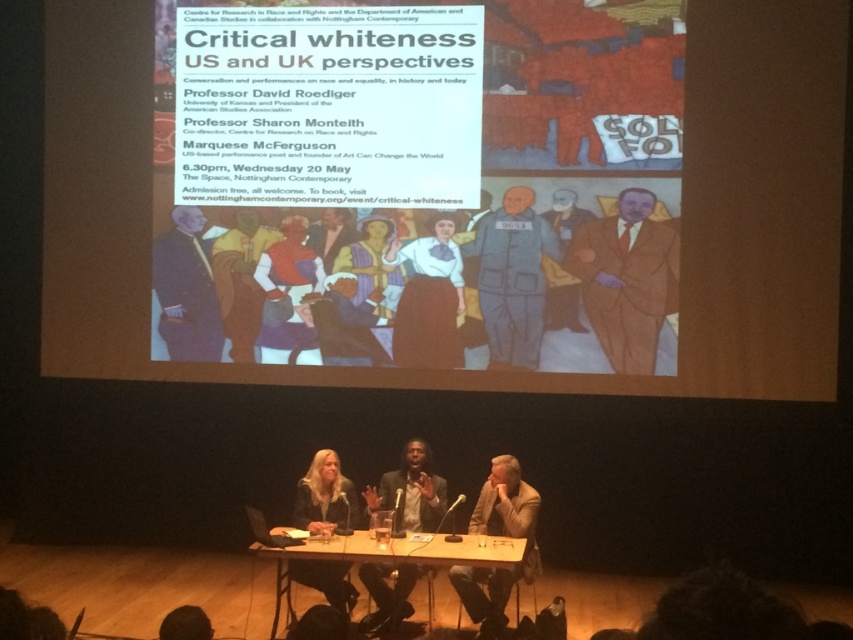
Question: Based on their relative distances, which object is farther from the brown textured suit at right?

Choices:
 (A) matte black suit at center
 (B) light brown leather jacket at lower right
 (C) wooden at center
 (D) matte paper poster at center

Answer: (A)

Question: Is dark gray suit at center below matte black jacket at center?

Choices:
 (A) yes
 (B) no

Answer: (B)

Question: Which point is closer to the camera taking this photo?

Choices:
 (A) (209, 269)
 (B) (486, 589)
 (C) (579, 260)
 (D) (332, 568)

Answer: (D)

Question: Estimate the real-world distances between objects in this image. Which object is closer to the matte black jacket at center?

Choices:
 (A) wooden at center
 (B) matte paper poster at center
 (C) dark gray suit at center
 (D) brown textured suit at right

Answer: (C)

Question: Is matte paper poster at center in front of light brown leather jacket at lower right?

Choices:
 (A) yes
 (B) no

Answer: (B)

Question: Considering the relative positions of brown textured suit at right and matte gray jumpsuit at center in the image provided, where is brown textured suit at right located with respect to matte gray jumpsuit at center?

Choices:
 (A) left
 (B) right

Answer: (B)